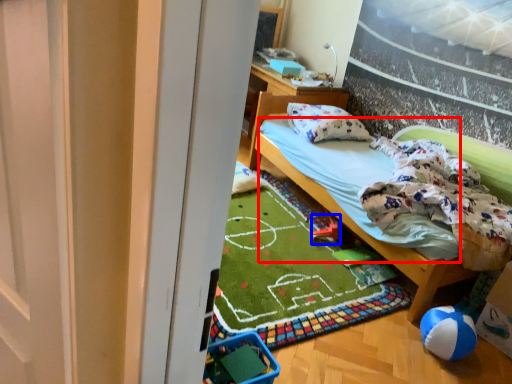
Question: Which of the following is the closest to the observer, mattress (highlighted by a red box) or toy (highlighted by a blue box)?

Choices:
 (A) mattress
 (B) toy

Answer: (A)